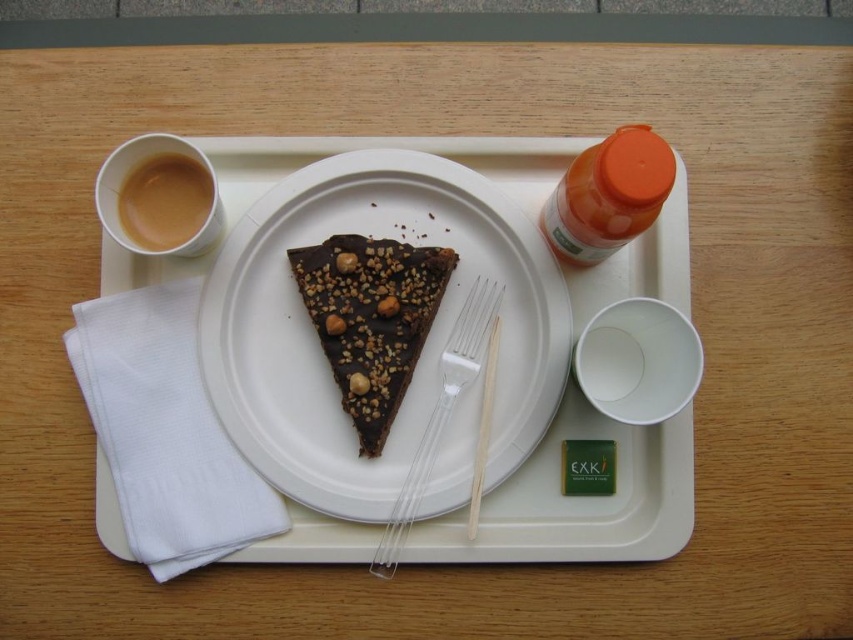
Question: Which point is closer to the camera taking this photo?

Choices:
 (A) (459, 339)
 (B) (158, 220)

Answer: (B)

Question: Which is nearer to the brown liquid cup at top left?

Choices:
 (A) chocolate-coated cake at center
 (B) orange matte bottle at upper right
 (C) chocolatecrumblyslice at center

Answer: (C)

Question: Can you confirm if orange matte bottle at upper right is positioned below brown textured nut at center?

Choices:
 (A) no
 (B) yes

Answer: (A)

Question: Is brown liquid cup at top left positioned before brown textured nut at center?

Choices:
 (A) yes
 (B) no

Answer: (A)

Question: Which of these objects is positioned farthest from the transparent plastic fork at center?

Choices:
 (A) brown textured nut at center
 (B) orange matte bottle at upper right
 (C) brown liquid cup at top left
 (D) chocolate-coated cake at center

Answer: (C)

Question: Is chocolatecrumblyslice at center to the right of orange matte bottle at upper right from the viewer's perspective?

Choices:
 (A) yes
 (B) no

Answer: (B)